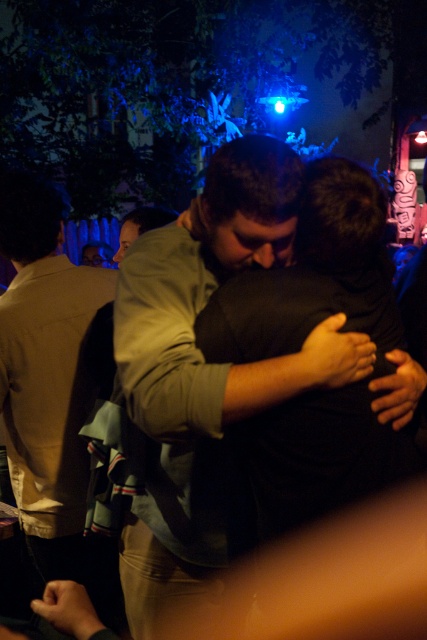
Can you confirm if light brown leather jacket at left is positioned below matte green shirt at center?

Correct, light brown leather jacket at left is located below matte green shirt at center.

Which is behind, point (61, 576) or point (149, 212)?

Positioned behind is point (149, 212).

Which is behind, point (88, 365) or point (157, 227)?

The point (157, 227) is behind.

I want to click on light brown leather jacket at left, so click(49, 385).